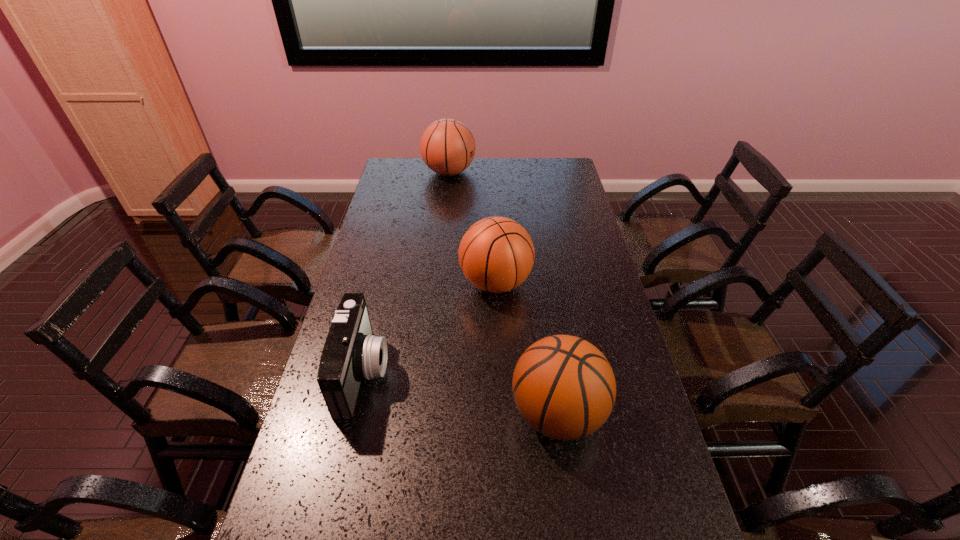
Where is `basketball that stands as the closest to the second nearest basketball`? basketball that stands as the closest to the second nearest basketball is located at coordinates (564, 387).

Identify which basketball is located as the nearest to the third nearest object. Please provide its 2D coordinates. Your answer should be formatted as a tuple, i.e. [(x, y)], where the tuple contains the x and y coordinates of a point satisfying the conditions above.

[(564, 387)]

This screenshot has height=540, width=960. I want to click on free region that satisfies the following two spatial constraints: 1. on the surface of the farthest object near the brand logo; 2. on the left side of the second farthest object, so click(438, 283).

The height and width of the screenshot is (540, 960). What are the coordinates of `vacant area in the image that satisfies the following two spatial constraints: 1. on the surface of the farthest object near the brand logo; 2. on the back side of the nearest basketball` in the screenshot? It's located at (423, 413).

Find the location of a particular element. The width and height of the screenshot is (960, 540). free point that satisfies the following two spatial constraints: 1. on the lens of the nearest basketball; 2. on the left side of the camcorder is located at coordinates (354, 413).